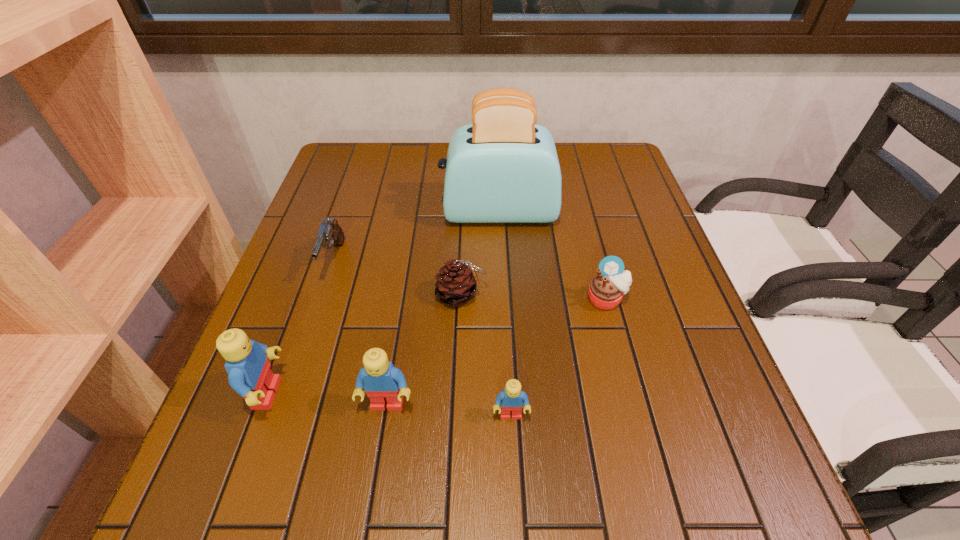
Observe the arrangement of all Legos in the image. To keep them evenly spaced, where would you place another Lego on the right? Please locate a free space. Please provide its 2D coordinates. Your answer should be formatted as a tuple, i.e. [(x, y)], where the tuple contains the x and y coordinates of a point satisfying the conditions above.

[(639, 426)]